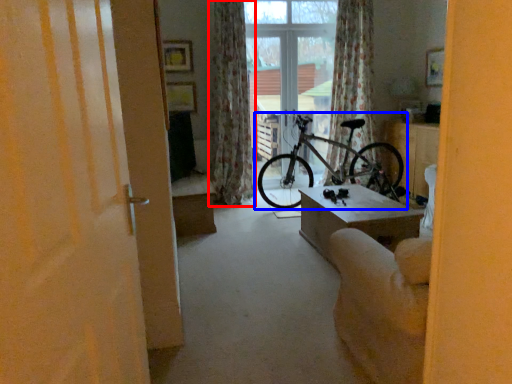
Question: Which point is closer to the camera, curtain (highlighted by a red box) or bicycle (highlighted by a blue box)?

Choices:
 (A) curtain
 (B) bicycle

Answer: (B)